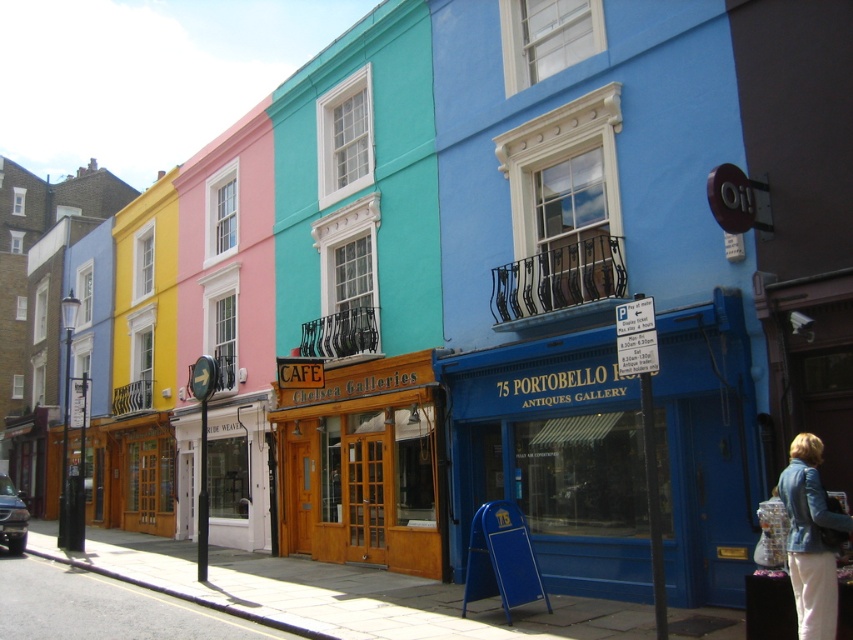
Question: Which is farther from the wooden door at center?

Choices:
 (A) blue matte building at center
 (B) denim jacket at lower right

Answer: (B)

Question: Can you confirm if wooden door at center is positioned above denim jacket at lower right?

Choices:
 (A) yes
 (B) no

Answer: (B)

Question: Is the position of blue matte building at center more distant than that of denim jacket at lower right?

Choices:
 (A) yes
 (B) no

Answer: (A)

Question: Estimate the real-world distances between objects in this image. Which object is closer to the wooden door at center?

Choices:
 (A) denim jacket at lower right
 (B) blue matte building at center

Answer: (B)

Question: Which object is positioned closest to the blue matte building at center?

Choices:
 (A) denim jacket at lower right
 (B) wooden door at center

Answer: (B)

Question: Where is blue matte building at center located in relation to wooden door at center in the image?

Choices:
 (A) above
 (B) below

Answer: (A)